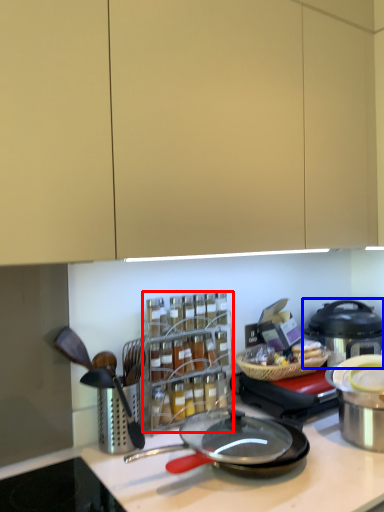
Question: Which of the following is the farthest to the observer, spice rack (highlighted by a red box) or kitchen appliance (highlighted by a blue box)?

Choices:
 (A) spice rack
 (B) kitchen appliance

Answer: (B)